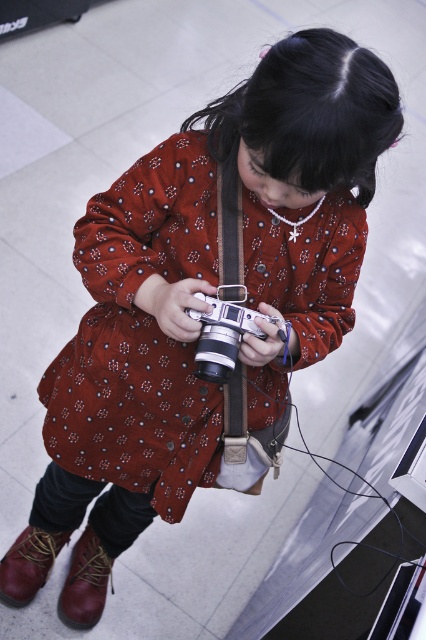
Can you confirm if silver metallic camera at center is positioned below brown leather boot at lower left?

No.

What do you see at coordinates (226, 336) in the screenshot? I see `silver metallic camera at center` at bounding box center [226, 336].

At what (x,y) coordinates should I click in order to perform the action: click on silver metallic camera at center. Please return your answer as a coordinate pair (x, y). Looking at the image, I should click on (226, 336).

Based on the photo, is silver metallic camera at center wider than leather boot at lower left?

Yes.

Does point (206, 362) lie in front of point (9, 579)?

Yes, it is.

From the picture: Measure the distance between silver metallic camera at center and camera.

silver metallic camera at center is 4.19 feet from camera.

Identify the location of silver metallic camera at center. The height and width of the screenshot is (640, 426). (226, 336).

Is point (75, 605) positioned in front of point (46, 532)?

No, it is not.

Is brown leather boot at lower left below leather boot at lower left?

Yes, brown leather boot at lower left is below leather boot at lower left.

In order to click on brown leather boot at lower left in this screenshot , I will do `click(85, 582)`.